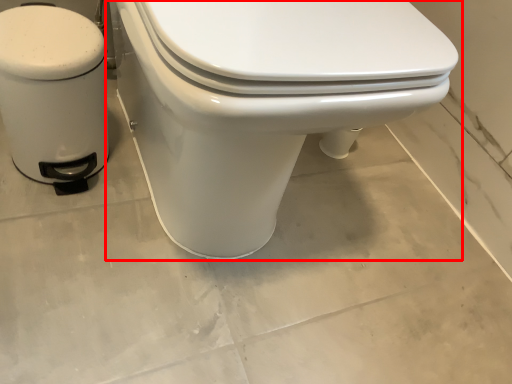
Question: Where is toilet (annotated by the red box) located in relation to water heater in the image?

Choices:
 (A) right
 (B) left

Answer: (A)